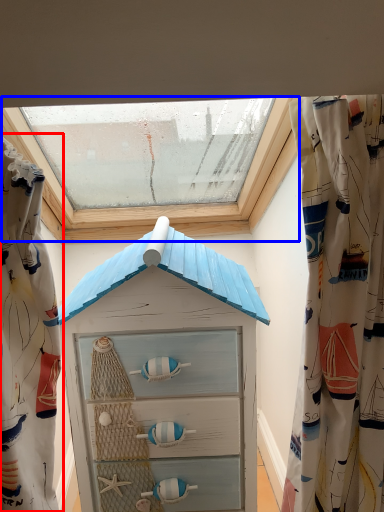
Question: Which of the following is the closest to the observer, curtain (highlighted by a red box) or window (highlighted by a blue box)?

Choices:
 (A) curtain
 (B) window

Answer: (A)